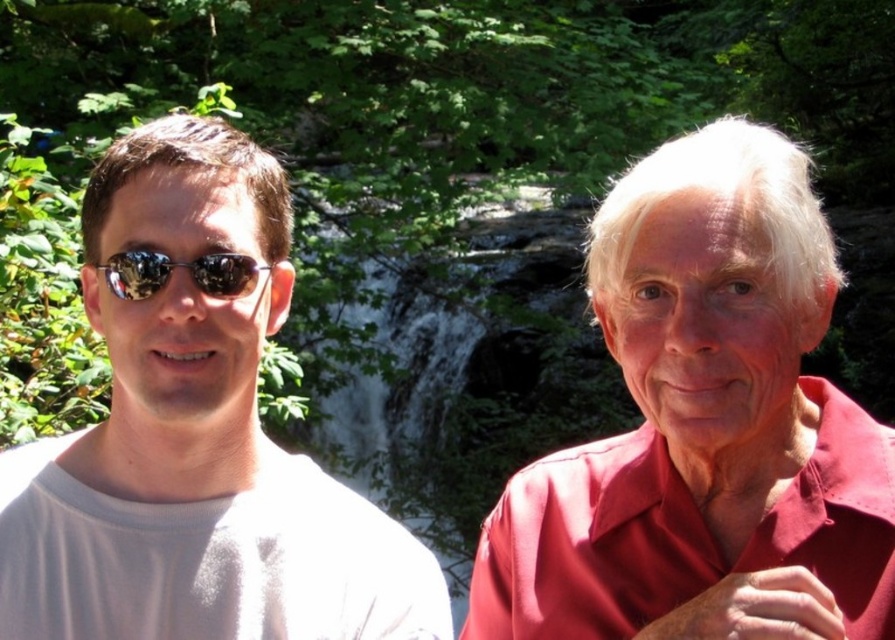
Question: Can you confirm if matte red shirt at center is positioned above sunglasses at left?

Choices:
 (A) yes
 (B) no

Answer: (B)

Question: Which of these objects is positioned closest to the sunglasses at left?

Choices:
 (A) matte red shirt at center
 (B) white matte shirt at left

Answer: (B)

Question: Which point is closer to the camera?

Choices:
 (A) sunglasses at left
 (B) matte red shirt at center

Answer: (B)

Question: Is matte red shirt at center to the left of white matte shirt at left from the viewer's perspective?

Choices:
 (A) no
 (B) yes

Answer: (A)

Question: Which point appears farthest from the camera in this image?

Choices:
 (A) (199, 266)
 (B) (705, 333)

Answer: (A)

Question: Considering the relative positions of white matte shirt at left and sunglasses at left in the image provided, where is white matte shirt at left located with respect to sunglasses at left?

Choices:
 (A) left
 (B) right

Answer: (A)